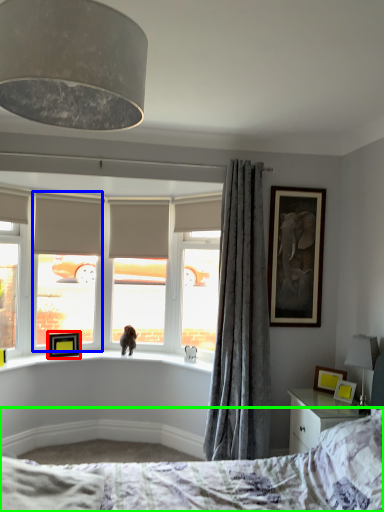
Question: Based on their relative distances, which object is farther from picture frame (highlighted by a red box)? Choose from window screen (highlighted by a blue box) and bed (highlighted by a green box).

Choices:
 (A) window screen
 (B) bed

Answer: (B)